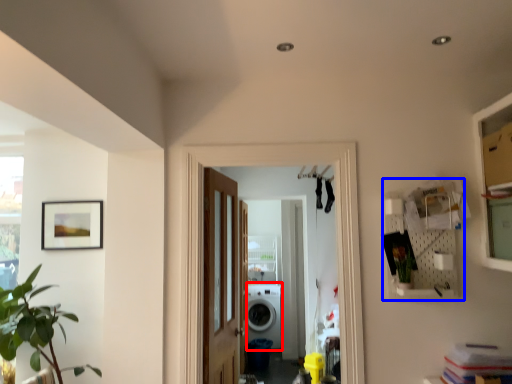
Question: Which object appears closest to the camera in this image, washing machine (highlighted by a red box) or shelf (highlighted by a blue box)?

Choices:
 (A) washing machine
 (B) shelf

Answer: (B)